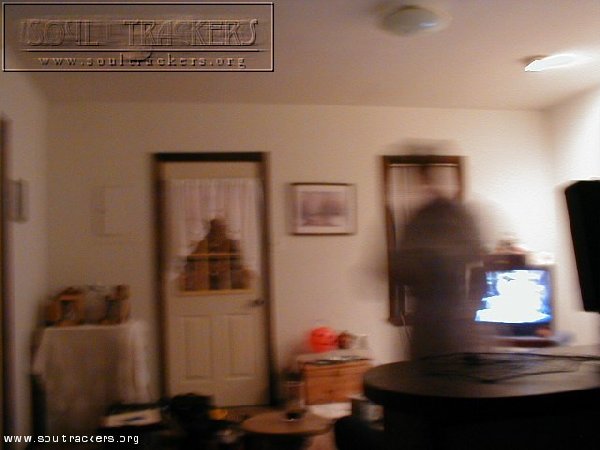
I want to click on picture, so pyautogui.click(x=332, y=210).